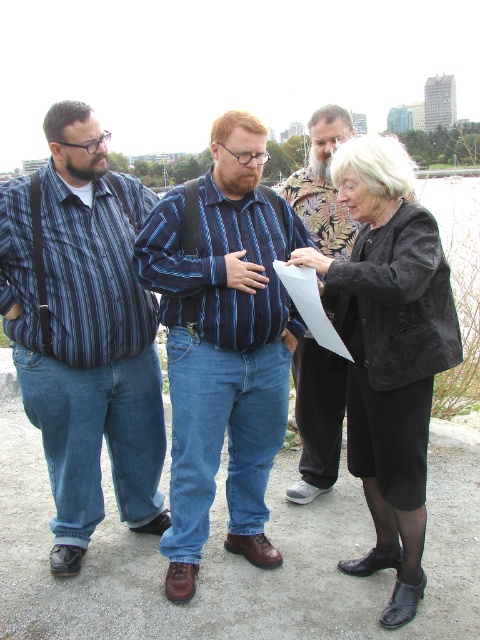
You are a photographer trying to capture a group photo of the blue striped shirt at center and the black suede jacket at center. Since you want to ensure both subjects are in focus, you need to know their heights. Which of the two is taller?

The blue striped shirt at center is taller than the black suede jacket at center, so you should adjust your camera settings to accommodate the height difference for proper focus.

You are a photographer at the waterfront scene. You want to frame a photo such that the striped cotton shirt at left and the blue striped shirt at center are both visible. Given their height difference, which shirt should you adjust your camera angle to focus on to ensure both are fully visible?

The striped cotton shirt at left is taller than the blue striped shirt at center. To ensure both are fully visible, you should position your camera angle slightly lower to accommodate the taller striped cotton shirt at left while still capturing the shorter blue striped shirt at center in the frame.